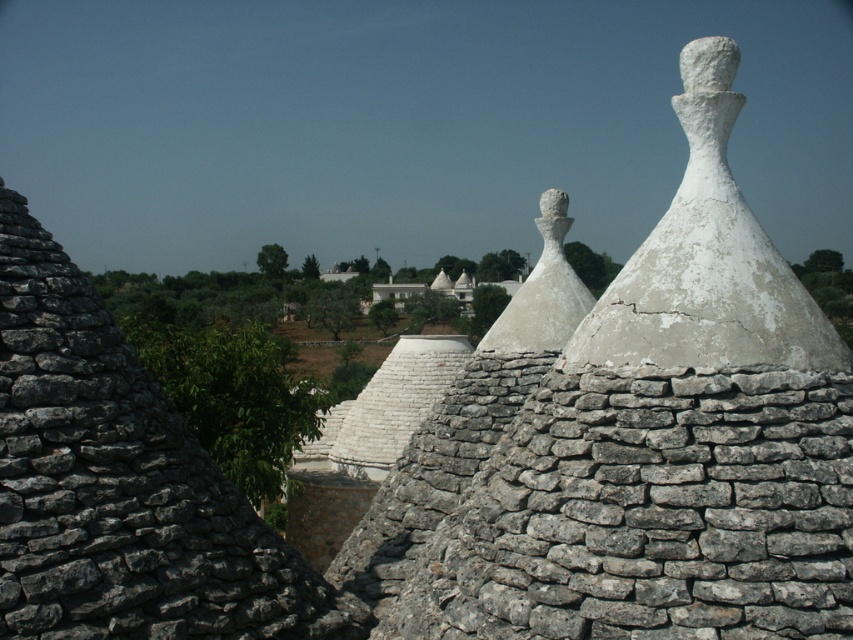
Between white cracked stone cone at center and white stone statue at center, which one has less height?

Standing shorter between the two is white stone statue at center.

Can you confirm if white cracked stone cone at center is thinner than white stone statue at center?

Incorrect, white cracked stone cone at center's width is not less than white stone statue at center's.

Between point (701, 148) and point (561, 294), which one is positioned behind?

Point (561, 294)

You are a GUI agent. You are given a task and a screenshot of the screen. Output one action in this format:
    pyautogui.click(x=<x>, y=<y>)
    Task: Click on the white cracked stone cone at center
    The height and width of the screenshot is (640, 853).
    Given the screenshot: What is the action you would take?
    pyautogui.click(x=706, y=260)